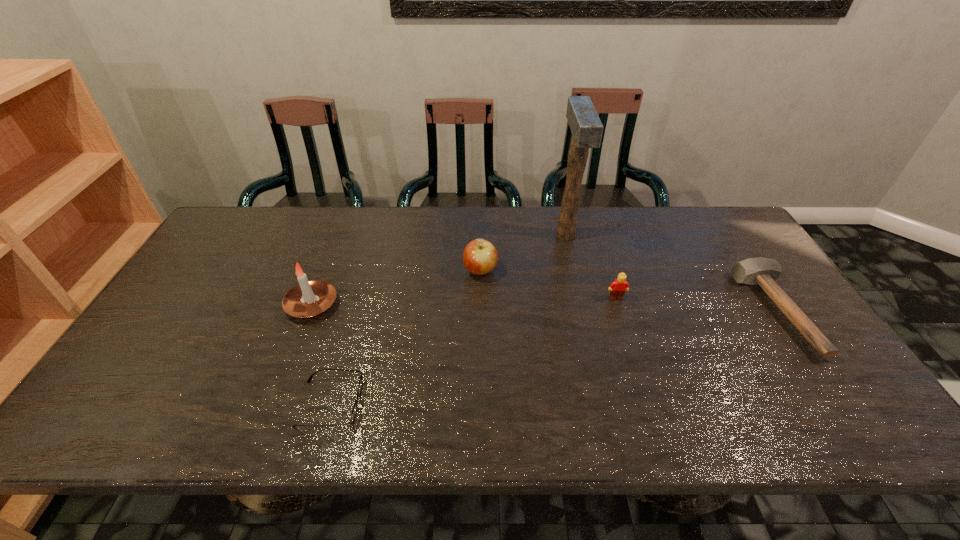
This screenshot has height=540, width=960. I want to click on vacant space at the far left corner of the desktop, so click(x=225, y=228).

You are a GUI agent. You are given a task and a screenshot of the screen. Output one action in this format:
    pyautogui.click(x=<x>, y=<y>)
    Task: Click on the blank area at the far right corner
    The width and height of the screenshot is (960, 540).
    Given the screenshot: What is the action you would take?
    pyautogui.click(x=707, y=232)

Identify the location of empty location between the second object from right to left and the rightmost object. (695, 305).

The height and width of the screenshot is (540, 960). I want to click on free space between the apple and the nearer mallet, so click(x=628, y=291).

Find the location of a particular element. vacant area that lies between the fourth object from left to right and the candle is located at coordinates (439, 270).

At what (x,y) coordinates should I click in order to perform the action: click on vacant space that is in between the second tallest object and the Lego. Please return your answer as a coordinate pair (x, y). The height and width of the screenshot is (540, 960). Looking at the image, I should click on (464, 301).

Where is `unoccupied position between the rightmost object and the second object from right to left`? This screenshot has width=960, height=540. unoccupied position between the rightmost object and the second object from right to left is located at coordinates (695, 305).

Locate an element on the screen. free space between the candle and the spectacles is located at coordinates (322, 354).

Where is `free space that is in between the shortest object and the Lego`? This screenshot has width=960, height=540. free space that is in between the shortest object and the Lego is located at coordinates (473, 350).

Identify the location of empty space that is in between the second shortest object and the spectacles. (553, 357).